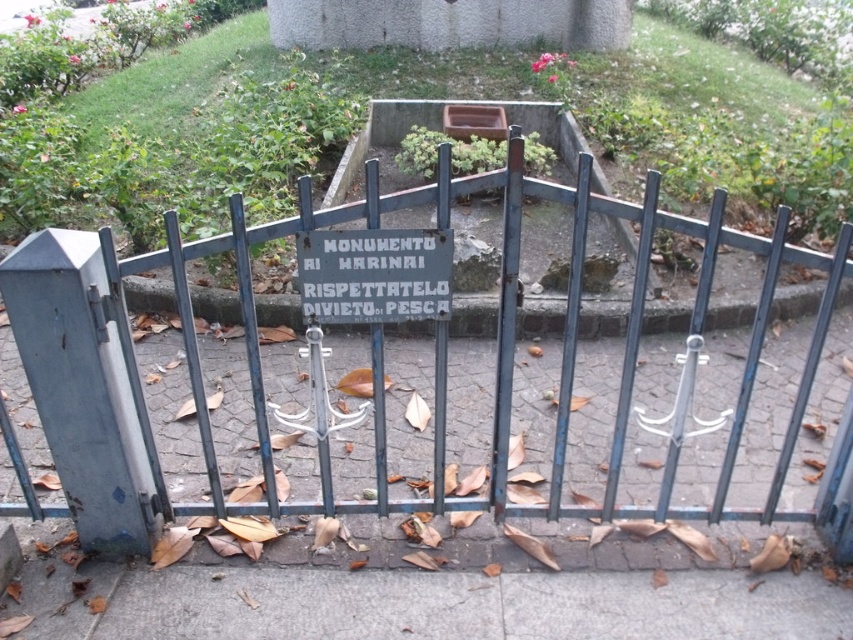
Between blue painted metal gate at center and white stone sign at center, which one has less height?

white stone sign at center

Is blue painted metal gate at center shorter than white stone sign at center?

Incorrect, blue painted metal gate at center's height does not fall short of white stone sign at center's.

Between point (488, 504) and point (364, 305), which one is positioned in front?

Point (364, 305) is in front.

Where is `blue painted metal gate at center`? The image size is (853, 640). blue painted metal gate at center is located at coordinates (434, 362).

Based on the photo, which is more to the left, blue painted metal gate at center or gray metallic gate at left?

From the viewer's perspective, gray metallic gate at left appears more on the left side.

Can you confirm if blue painted metal gate at center is smaller than gray metallic gate at left?

Actually, blue painted metal gate at center might be larger than gray metallic gate at left.

Is point (799, 515) positioned before point (115, 536)?

No.

Where is `blue painted metal gate at center`? The image size is (853, 640). blue painted metal gate at center is located at coordinates (434, 362).

Who is more distant from viewer, (115, 486) or (444, 241)?

The point (115, 486) is behind.

Is point (113, 323) more distant than point (363, 232)?

Yes, it is behind point (363, 232).

Locate an element on the screen. gray metallic gate at left is located at coordinates (80, 387).